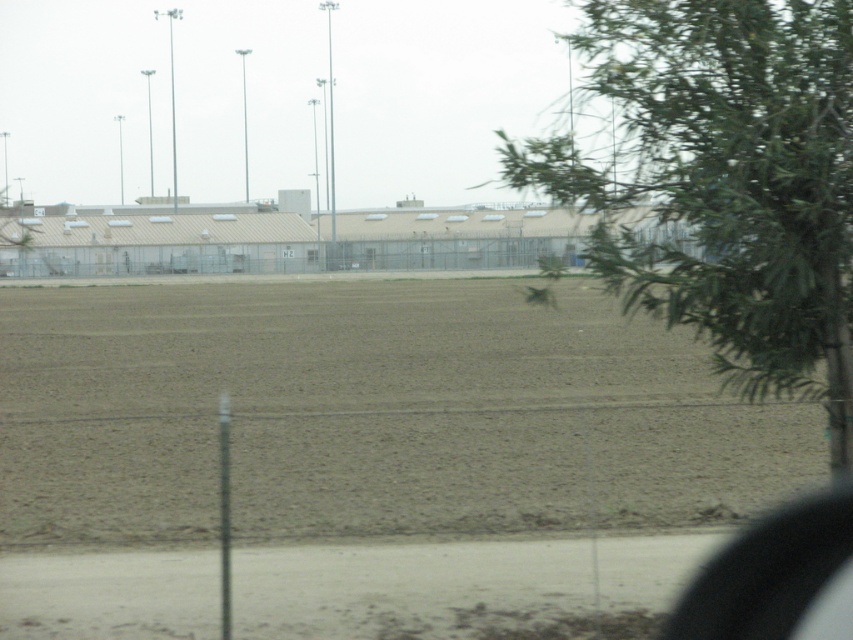
Can you confirm if brown soil at center is taller than green leafy tree at upper right?

No.

Does brown soil at center have a lesser width compared to green leafy tree at upper right?

Incorrect, brown soil at center's width is not less than green leafy tree at upper right's.

Find the location of a particular element. This screenshot has width=853, height=640. brown soil at center is located at coordinates (370, 416).

Is brown soil at center bigger than transparent glass car window at lower right?

Correct, brown soil at center is larger in size than transparent glass car window at lower right.

Is brown soil at center wider than transparent glass car window at lower right?

Correct, the width of brown soil at center exceeds that of transparent glass car window at lower right.

Between point (596, 404) and point (843, 612), which one is positioned behind?

Point (596, 404)

I want to click on brown soil at center, so click(370, 416).

Which is above, green leafy tree at upper right or transparent glass car window at lower right?

green leafy tree at upper right is higher up.

Measure the distance between green leafy tree at upper right and camera.

8.47 meters

Where is `green leafy tree at upper right`? This screenshot has height=640, width=853. green leafy tree at upper right is located at coordinates 724,182.